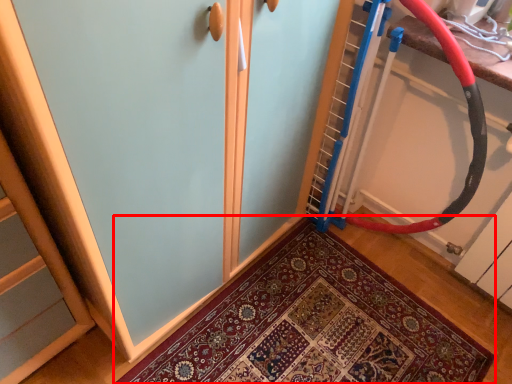
Question: From the image's perspective, considering the relative positions of mat (annotated by the red box) and garden hose in the image provided, where is mat (annotated by the red box) located with respect to the staircase?

Choices:
 (A) above
 (B) below

Answer: (B)